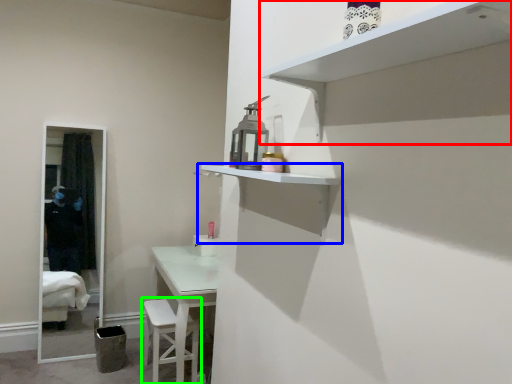
Question: Which object is the farthest from shelf (highlighted by a red box)? Choose among these: shelf (highlighted by a blue box) or step stool (highlighted by a green box).

Choices:
 (A) shelf
 (B) step stool

Answer: (B)